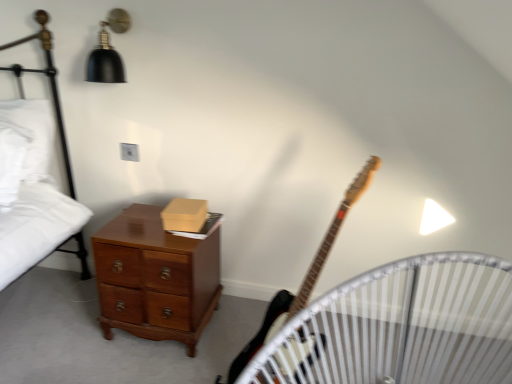
Locate an element on the screen. vacant space positioned to the left of matte brown box at center is located at coordinates pos(145,213).